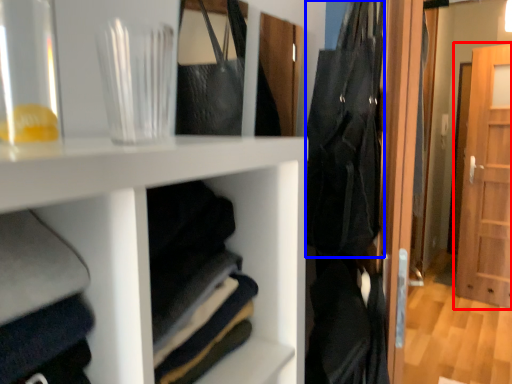
Question: Which object is closer to the camera taking this photo, door (highlighted by a red box) or clothing (highlighted by a blue box)?

Choices:
 (A) door
 (B) clothing

Answer: (B)